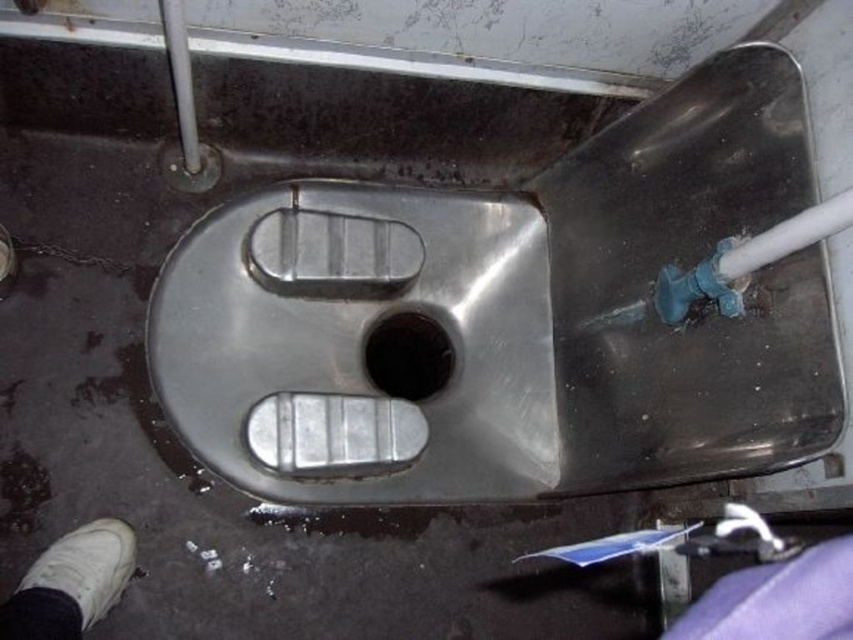
You are standing in front of the metallic squat toilet and need to locate two specific points marked on the floor. The first point is at coordinates point (498,324) and the second is at point (74,616). Which point is closer to you?

Point (498,324) is closer to you because it is further to the viewer than point (74,616).

You are a maintenance worker inspecting the stainless steel urinal at center and the black rubber drain at center. Which object is positioned to the right side?

The black rubber drain at center is positioned to the right of the stainless steel urinal at center.

You are a maintenance worker checking the facilities. You need to compare the widths of the stainless steel urinal at center and the black rubber drain at center. Which one is wider?

The stainless steel urinal at center is wider than the black rubber drain at center according to the description.